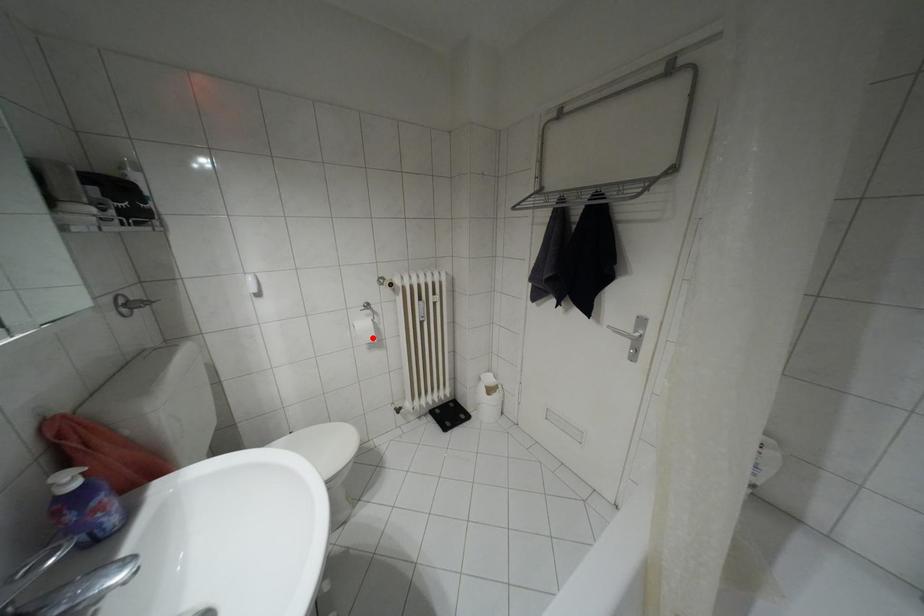
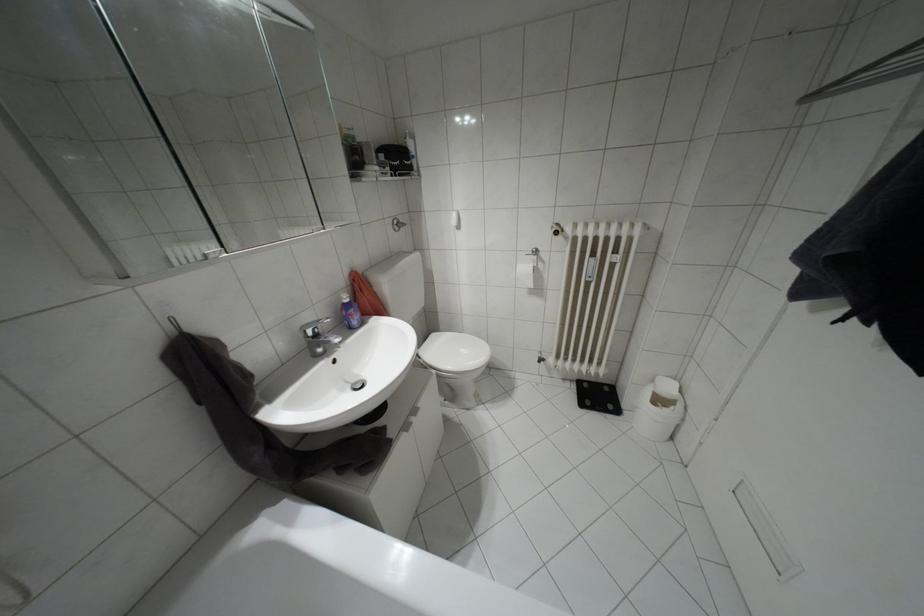
Question: I am providing you with two images of the same scene from different viewpoints. In image1, a red point is highlighted. Considering the same 3D point in image2, which of the following is correct?

Choices:
 (A) It is closer
 (B) It is farther

Answer: (B)